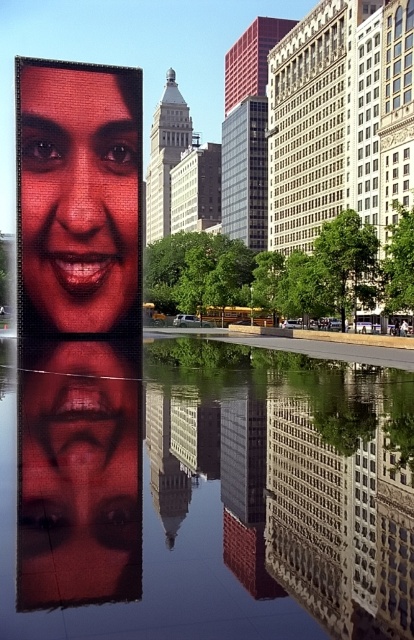
Question: Can you confirm if glossy reflective water at center is smaller than matte black face at center?

Choices:
 (A) yes
 (B) no

Answer: (B)

Question: Which object is closer to the camera taking this photo?

Choices:
 (A) glossy reflective water at center
 (B) matte red face at upper left

Answer: (A)

Question: Estimate the real-world distances between objects in this image. Which object is farther from the matte black face at center?

Choices:
 (A) matte red face at upper left
 (B) glossy reflective water at center

Answer: (A)

Question: Where is glossy reflective water at center located in relation to matte black face at center in the image?

Choices:
 (A) above
 (B) below

Answer: (B)

Question: Does matte red face at upper left have a greater width compared to matte black face at center?

Choices:
 (A) no
 (B) yes

Answer: (B)

Question: Which point appears farthest from the camera in this image?

Choices:
 (A) (69, 403)
 (B) (84, 131)

Answer: (B)